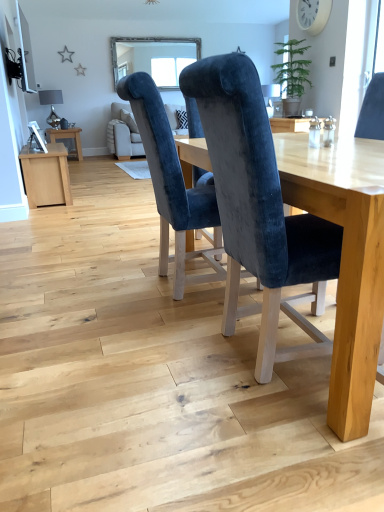
This screenshot has height=512, width=384. What are the coordinates of `free location in front of velvet blue chair at center, the second chair from the right` in the screenshot? It's located at (159, 321).